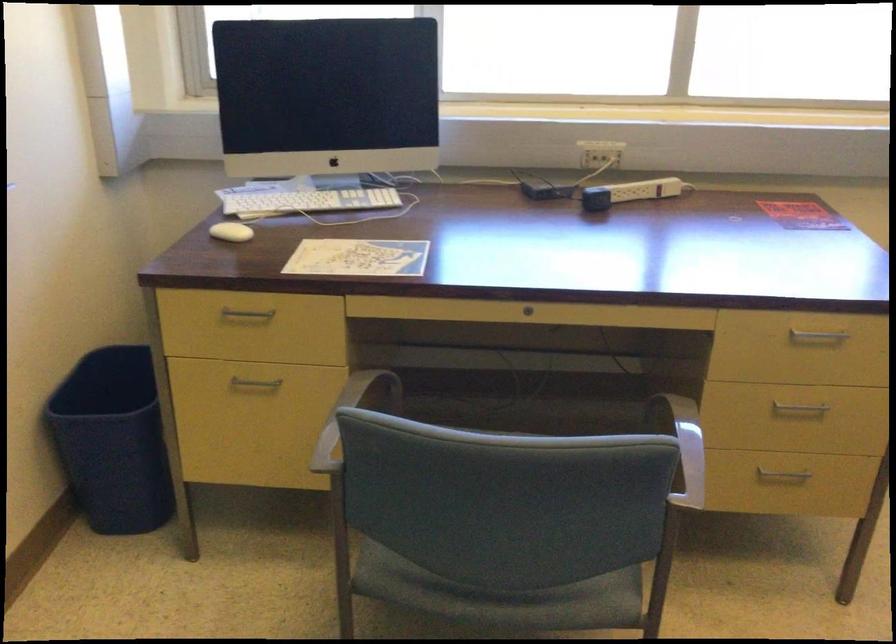
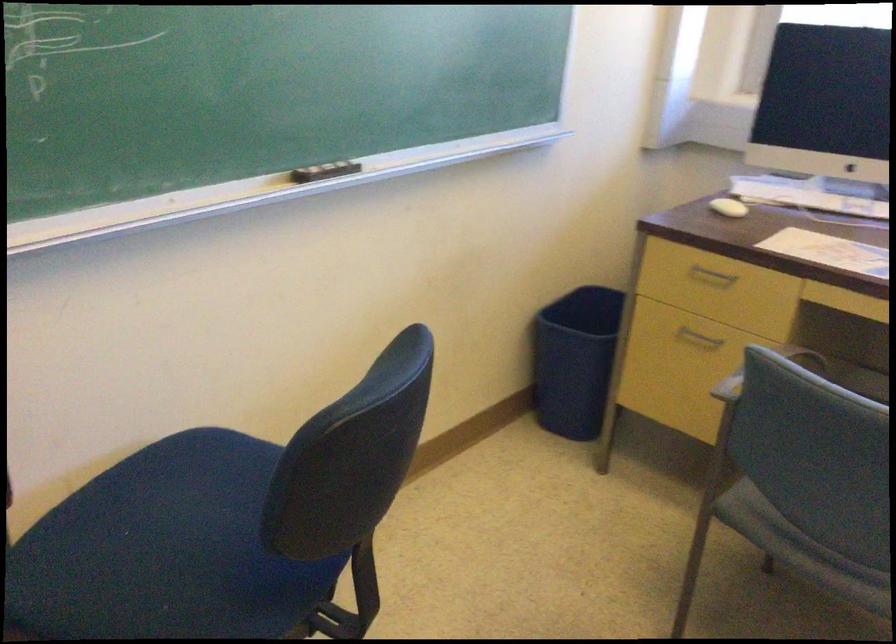
Where in the second image is the point corresponding to point 245,323 from the first image?

(711, 277)